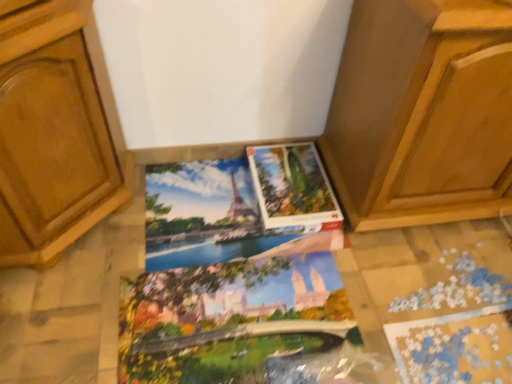
Where is `free space to the right of matte paper coloring book at center, marked as the first coloring book in a bottom-to-top arrangement`? The height and width of the screenshot is (384, 512). free space to the right of matte paper coloring book at center, marked as the first coloring book in a bottom-to-top arrangement is located at coordinates (421, 296).